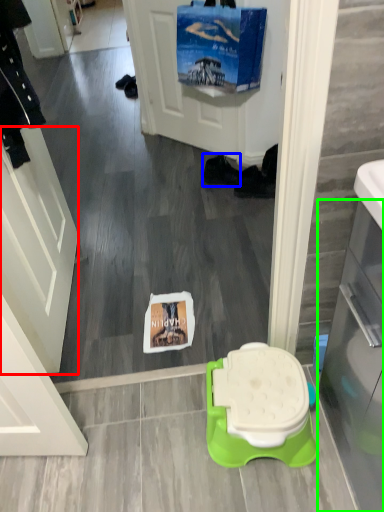
Question: Based on their relative distances, which object is nearer to screen door (highlighted by a red box)? Choose from footwear (highlighted by a blue box) and glass door (highlighted by a green box).

Choices:
 (A) footwear
 (B) glass door

Answer: (B)